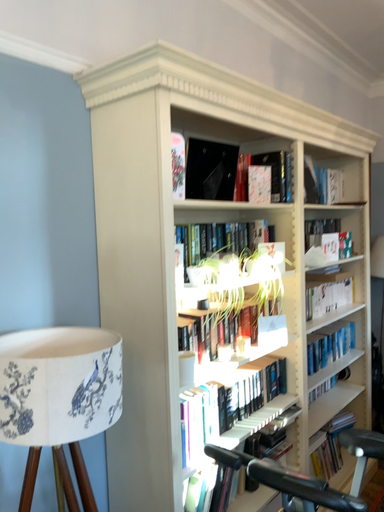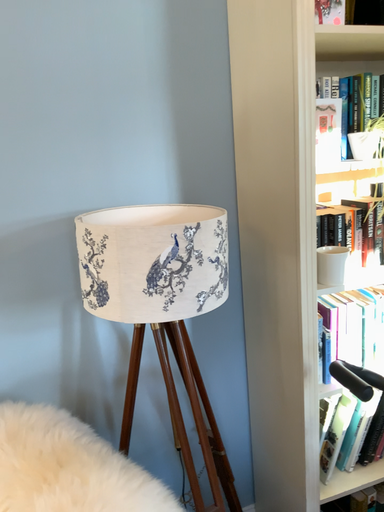
Question: How did the camera likely rotate when shooting the video?

Choices:
 (A) rotated downward
 (B) rotated upward

Answer: (A)